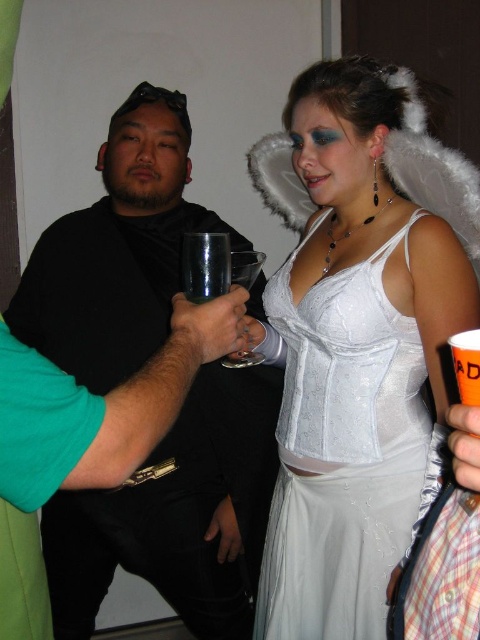
Is black matte shirt at left further to camera compared to satin white dress at center?

Yes.

Identify the location of black matte shirt at left. This screenshot has height=640, width=480. (178, 515).